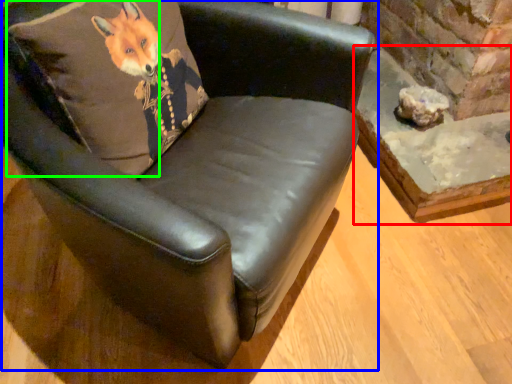
Question: Which object is the closest to the table (highlighted by a red box)? Choose among these: chair (highlighted by a blue box) or pillow (highlighted by a green box).

Choices:
 (A) chair
 (B) pillow

Answer: (A)